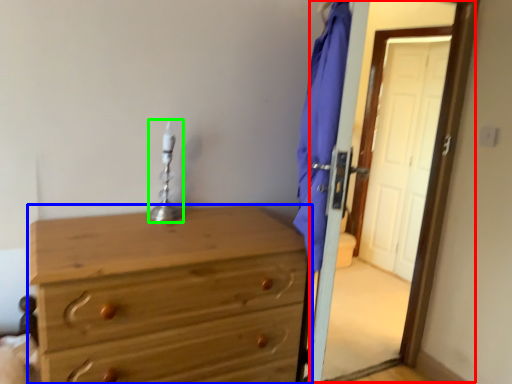
Question: Estimate the real-world distances between objects in this image. Which object is farther from screen door (highlighted by a red box), chest of drawers (highlighted by a blue box) or table lamp (highlighted by a green box)?

Choices:
 (A) chest of drawers
 (B) table lamp

Answer: (A)